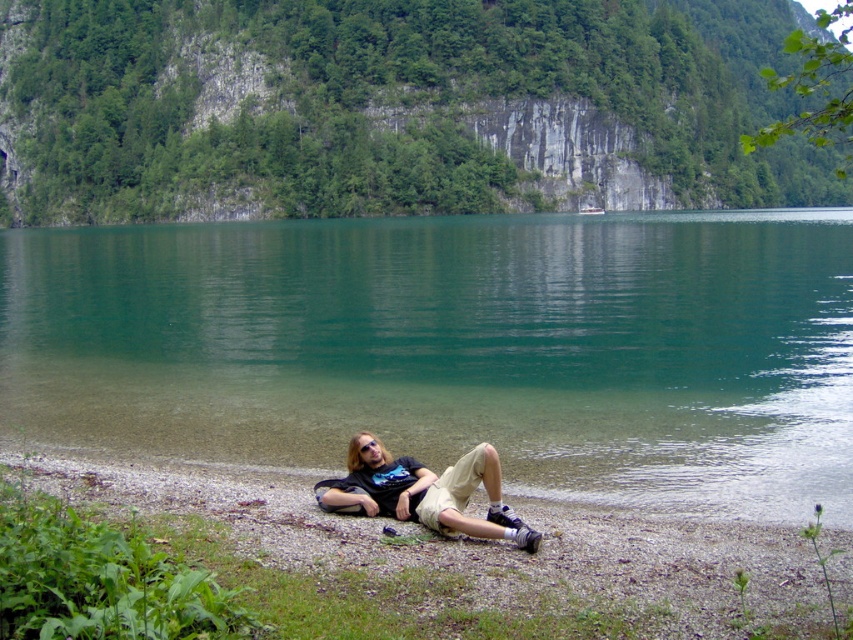
Which is in front, point (438, 326) or point (86, 488)?

Point (86, 488)

Does green smooth water at center appear under smooth gravel shoreline at lower center?

No, green smooth water at center is not below smooth gravel shoreline at lower center.

Image resolution: width=853 pixels, height=640 pixels. Find the location of `green smooth water at center`. green smooth water at center is located at coordinates (456, 348).

Who is shorter, green smooth water at center or matte black t-shirt at lower center?

Standing shorter between the two is matte black t-shirt at lower center.

Is point (251, 452) positioned before point (491, 492)?

No.

This screenshot has height=640, width=853. Identify the location of green smooth water at center. (456, 348).

Does smooth gravel shoreline at lower center have a lesser width compared to matte black t-shirt at lower center?

No.

Does smooth gravel shoreline at lower center have a smaller size compared to matte black t-shirt at lower center?

Incorrect, smooth gravel shoreline at lower center is not smaller in size than matte black t-shirt at lower center.

Is point (514, 605) positioned before point (358, 445)?

Yes, point (514, 605) is closer to viewer.

The width and height of the screenshot is (853, 640). In order to click on smooth gravel shoreline at lower center in this screenshot , I will do `click(488, 556)`.